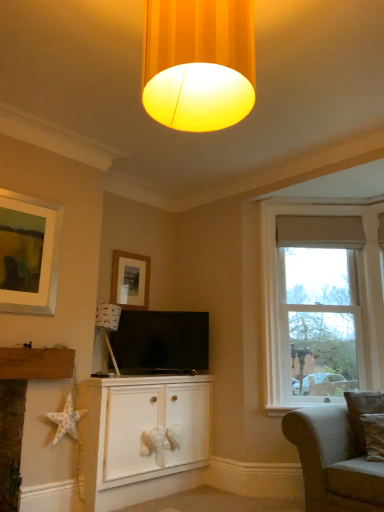
Where is `wooden picture frame at upper center`? The image size is (384, 512). wooden picture frame at upper center is located at coordinates (130, 280).

The image size is (384, 512). Find the location of `clear glass window at right`. clear glass window at right is located at coordinates (321, 303).

Where is `white paper star at lower left`? white paper star at lower left is located at coordinates [66, 420].

Locate an element on the screen. light gray fabric couch at lower right is located at coordinates (337, 455).

The height and width of the screenshot is (512, 384). What are the coordinates of `brown textured pillow at lower right` in the screenshot? It's located at (362, 410).

This screenshot has width=384, height=512. I want to click on matte yellow fabric lampshade at upper center, so click(198, 63).

Find the location of a particular element. Image resolution: width=384 pixels, height=512 pixels. wooden picture frame at upper center is located at coordinates (130, 280).

Looking at the image, does white matte cabinet at center seem bigger or smaller compared to light gray fabric couch at lower right?

In the image, white matte cabinet at center appears to be larger than light gray fabric couch at lower right.

Which object is wider, white matte cabinet at center or light gray fabric couch at lower right?

light gray fabric couch at lower right.

Which object is positioned more to the right, white matte cabinet at center or light gray fabric couch at lower right?

From the viewer's perspective, light gray fabric couch at lower right appears more on the right side.

In the scene shown: What's the angular difference between white matte cabinet at center and light gray fabric couch at lower right's facing directions?

They differ by 88.9 degrees in their facing directions.

Can we say light gray fabric couch at lower right lies outside clear glass window at right?

Yes, light gray fabric couch at lower right is located beyond the bounds of clear glass window at right.

Can you confirm if light gray fabric couch at lower right is bigger than clear glass window at right?

Indeed, light gray fabric couch at lower right has a larger size compared to clear glass window at right.

Between point (295, 428) and point (346, 331), which one is positioned behind?

The point (346, 331) is farther from the camera.

Locate an element on the screen. studio couch located in front of the clear glass window at right is located at coordinates (337, 455).

Looking at the image, does white paper star at lower left seem bigger or smaller compared to wooden picture frame at upper center?

Considering their sizes, white paper star at lower left takes up more space than wooden picture frame at upper center.

Are white paper star at lower left and wooden picture frame at upper center far apart?

white paper star at lower left is positioned a significant distance from wooden picture frame at upper center.

From a real-world perspective, which object stands above the other?

wooden picture frame at upper center is physically above.

Based on the photo, from the image's perspective, does wooden picture frame at upper center appear lower than clear glass window at right?

No, from the image's perspective, wooden picture frame at upper center is not below clear glass window at right.

Is wooden picture frame at upper center oriented away from clear glass window at right?

wooden picture frame at upper center does not have its back to clear glass window at right.

Which point is more forward, (125,286) or (303,342)?

The point (125,286) is in front.

Looking at this image, measure the distance from light gray fabric couch at lower right to matte yellow fabric lampshade at upper center.

A distance of 2.36 meters exists between light gray fabric couch at lower right and matte yellow fabric lampshade at upper center.

Is light gray fabric couch at lower right thinner than matte yellow fabric lampshade at upper center?

Incorrect, the width of light gray fabric couch at lower right is not less than that of matte yellow fabric lampshade at upper center.

Are light gray fabric couch at lower right and matte yellow fabric lampshade at upper center beside each other?

There is a gap between light gray fabric couch at lower right and matte yellow fabric lampshade at upper center.

Considering the relative sizes of light gray fabric couch at lower right and matte yellow fabric lampshade at upper center in the image provided, is light gray fabric couch at lower right bigger than matte yellow fabric lampshade at upper center?

Correct, light gray fabric couch at lower right is larger in size than matte yellow fabric lampshade at upper center.

Is light gray fabric couch at lower right facing towards white paper star at lower left?

No.

In the scene shown: From a real-world perspective, is light gray fabric couch at lower right positioned over white paper star at lower left based on gravity?

No.

From the image's perspective, is light gray fabric couch at lower right on top of white paper star at lower left?

No, from the image's perspective, light gray fabric couch at lower right is not on top of white paper star at lower left.

Consider the image. Are light gray fabric couch at lower right and white paper star at lower left far apart?

Absolutely, light gray fabric couch at lower right is distant from white paper star at lower left.

Is matte black tv at center smaller than wooden picture frame at upper center?

No.

What's the angular difference between matte black tv at center and wooden picture frame at upper center's facing directions?

The angular difference between matte black tv at center and wooden picture frame at upper center is 39 degrees.

Which of these two, matte black tv at center or wooden picture frame at upper center, stands shorter?

wooden picture frame at upper center is shorter.

You are a GUI agent. You are given a task and a screenshot of the screen. Output one action in this format:
    pyautogui.click(x=<x>, y=<y>)
    Task: Click on the cabinetry that is below the light gray fabric couch at lower right (from the image's perspective)
    This screenshot has height=512, width=384.
    Given the screenshot: What is the action you would take?
    pyautogui.click(x=145, y=428)

At what (x,y) coordinates should I click in order to perform the action: click on window behind the light gray fabric couch at lower right. Please return your answer as a coordinate pair (x, y). Looking at the image, I should click on (321, 303).

Looking at the image, which one is located further to clear glass window at right, wooden picture frame at upper center or brown textured pillow at lower right?

wooden picture frame at upper center lies further to clear glass window at right than the other object.

Based on the photo, which object lies further to the anchor point white paper star at lower left, white textured star at lower left or light gray fabric couch at lower right?

The object further to white paper star at lower left is light gray fabric couch at lower right.

Estimate the real-world distances between objects in this image. Which object is further from white textured star at lower left, white paper star at lower left or white matte cabinet at center?

Among the two, white matte cabinet at center is located further to white textured star at lower left.

Based on their spatial positions, is wooden picture frame at upper center or brown textured pillow at lower right further from white textured star at lower left?

Based on the image, brown textured pillow at lower right appears to be further to white textured star at lower left.

Estimate the real-world distances between objects in this image. Which object is closer to wooden picture frame at upper center, white matte cabinet at center or matte black tv at center?

The object closer to wooden picture frame at upper center is matte black tv at center.

Considering their positions, is white paper star at lower left positioned closer to brown textured pillow at lower right than light gray fabric couch at lower right?

The object closer to brown textured pillow at lower right is light gray fabric couch at lower right.

Considering their positions, is light gray fabric couch at lower right positioned closer to white paper star at lower left than white textured star at lower left?

Based on the image, white textured star at lower left appears to be nearer to white paper star at lower left.

From the image, which object appears to be nearer to matte black tv at center, white paper star at lower left or light gray fabric couch at lower right?

The object closer to matte black tv at center is white paper star at lower left.

Locate an element on the screen. picture frame situated between white paper star at lower left and light gray fabric couch at lower right from left to right is located at coordinates (130, 280).

Where is `picture frame located between white paper star at lower left and brown textured pillow at lower right in the left-right direction`? picture frame located between white paper star at lower left and brown textured pillow at lower right in the left-right direction is located at coordinates (130, 280).

Locate an element on the screen. The image size is (384, 512). television between white matte cabinet at center and brown textured pillow at lower right in the horizontal direction is located at coordinates (161, 342).

I want to click on television located between wooden picture frame at upper center and brown textured pillow at lower right in the left-right direction, so click(x=161, y=342).